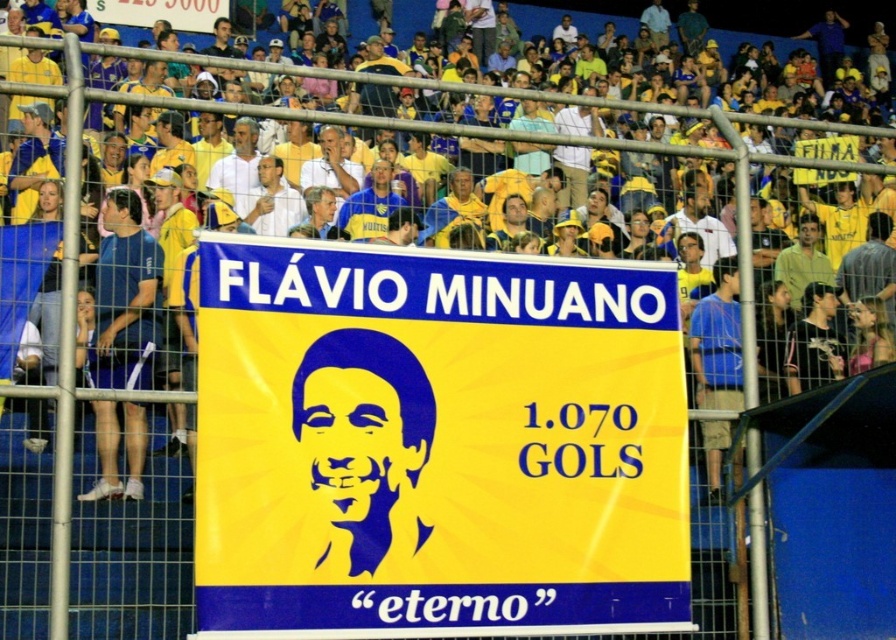
Which is in front, point (315, 582) or point (739, 369)?

Point (315, 582) is more forward.

What do you see at coordinates (437, 444) in the screenshot?
I see `yellow fabric banner at center` at bounding box center [437, 444].

Locate an element on the screen. yellow fabric banner at center is located at coordinates (437, 444).

Consider the image. Is blue fabric shirt at right wider than white shirt at center?

No, blue fabric shirt at right is not wider than white shirt at center.

Which of these two, blue fabric shirt at right or white shirt at center, stands taller?

With more height is white shirt at center.

Identify the location of blue fabric shirt at right. The image size is (896, 640). (718, 340).

Consider the image. Who is higher up, blue jersey at center or white matte shirt at center?

white matte shirt at center

Between blue jersey at center and white matte shirt at center, which one is positioned lower?

blue jersey at center

Who is more forward, (382, 163) or (343, 164)?

Point (382, 163) is in front.

This screenshot has width=896, height=640. I want to click on blue jersey at center, so click(369, 204).